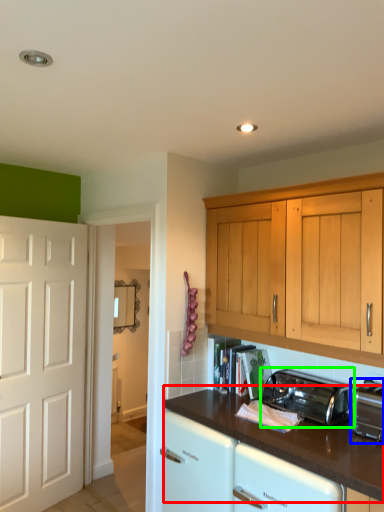
Question: Which object is the closest to the countertop (highlighted by a red box)? Choose among these: toaster (highlighted by a blue box) or toaster (highlighted by a green box).

Choices:
 (A) toaster
 (B) toaster

Answer: (B)